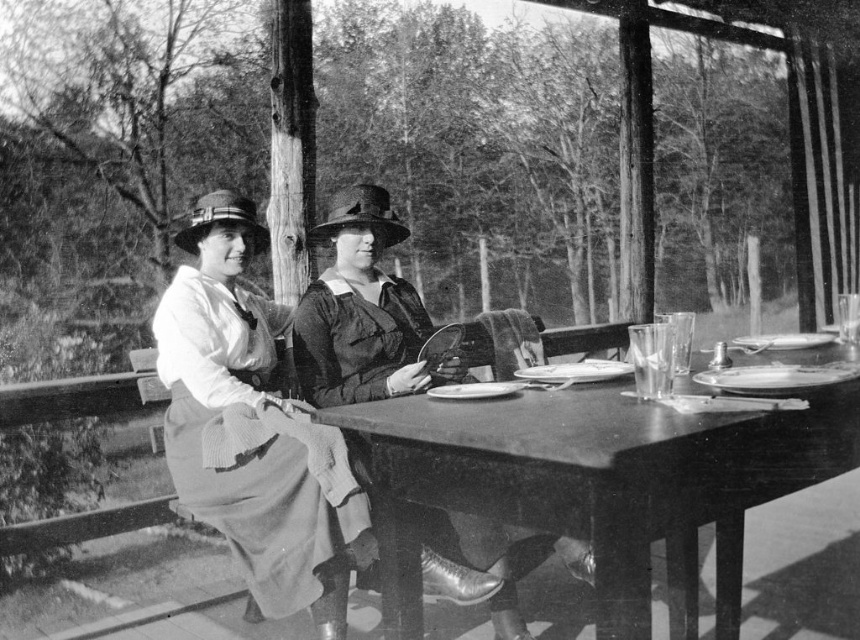
You are a photographer analyzing this black and white image. You notice the wooden table at center and the matte white blouse at center. Which object occupies more space in the image?

The matte white blouse at center occupies more space in the image since it is larger than the wooden table at center according to the description.

You are an artist analyzing the composition of this black and white photo. The image has a coordinate system where the bottom left corner is the origin point. You want to place a highlight on the matte white blouse at center. What are the coordinates where you should place the highlight?

The coordinates for the matte white blouse at center are at point (250, 428).

You are planning to place a matte black dress at center on the wooden table at center. Based on the scene description, will the dress fit on the table?

The wooden table at center has a larger size compared to matte black dress at center, so the dress will fit on the table.